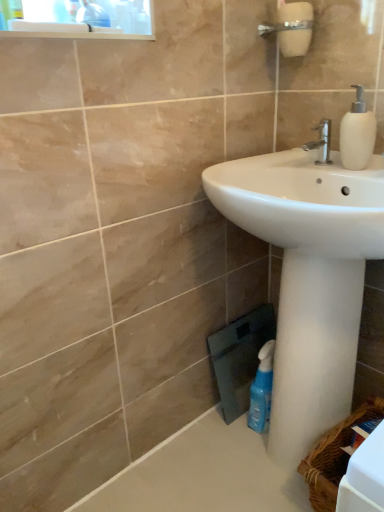
Question: From the image's perspective, relative to blue translucent bottle at lower right, is white matte soap dispenser at upper right above or below?

Choices:
 (A) below
 (B) above

Answer: (B)

Question: Considering their positions, is white matte soap dispenser at upper right located in front of or behind blue translucent bottle at lower right?

Choices:
 (A) behind
 (B) front

Answer: (B)

Question: Estimate the real-world distances between objects in this image. Which object is closer to the woven brown basket at lower right?

Choices:
 (A) silver metallic faucet at upper center
 (B) white matte soap dispenser at upper right
 (C) blue translucent bottle at lower right

Answer: (C)

Question: Which object is the closest to the blue translucent bottle at lower right?

Choices:
 (A) silver metallic faucet at upper center
 (B) white matte soap dispenser at upper right
 (C) woven brown basket at lower right

Answer: (C)